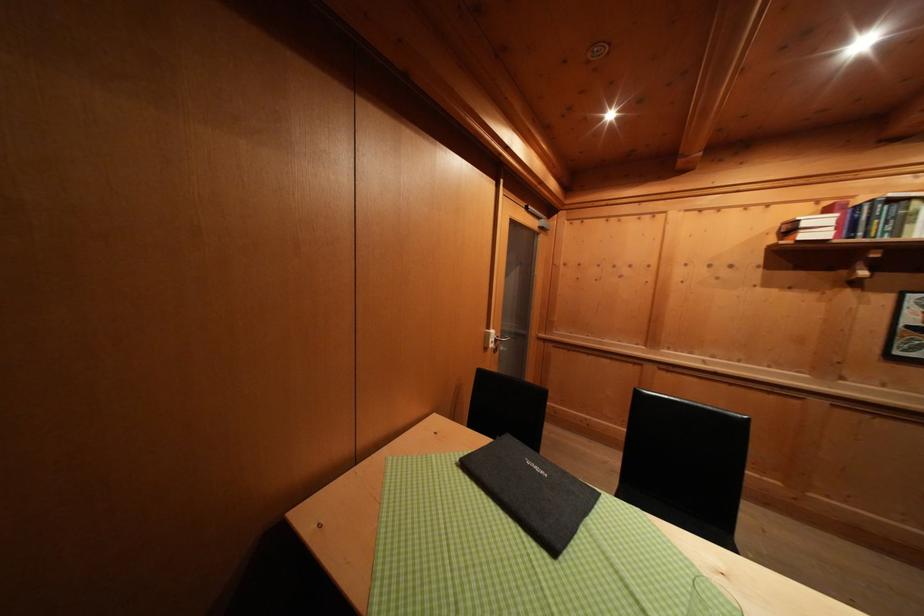
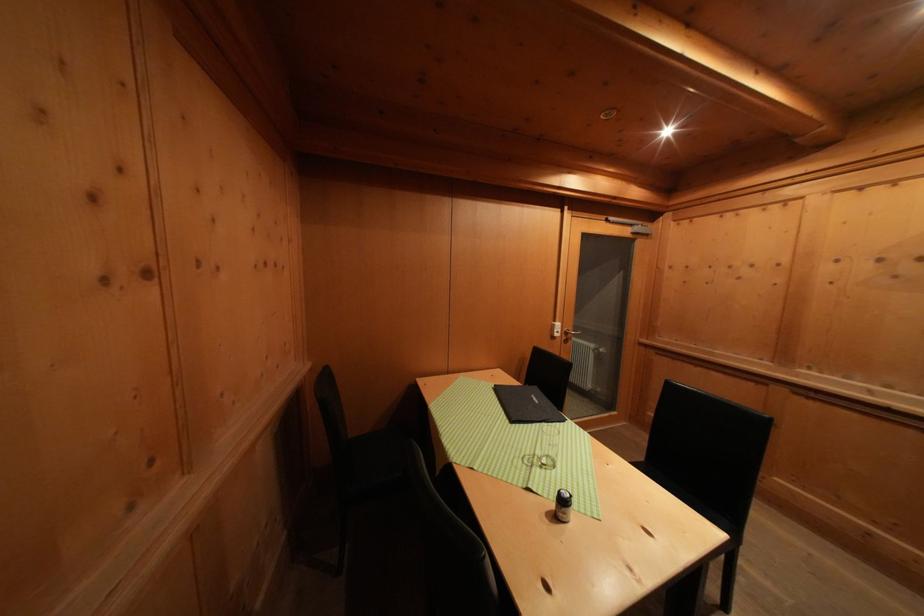
In the second image, find the point that corresponds to point (494, 333) in the first image.

(561, 326)